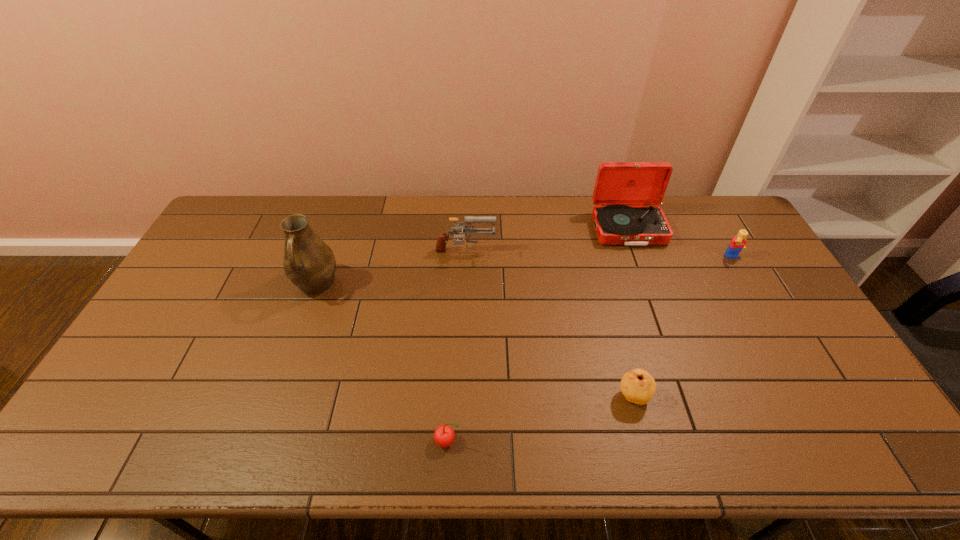
Locate an element on the screen. This screenshot has width=960, height=540. free space located 0.380m on the left of the fifth farthest object is located at coordinates (468, 396).

Locate an element on the screen. The width and height of the screenshot is (960, 540). free space located 0.180m on the right of the cherry is located at coordinates (537, 441).

Identify the location of object that is at the far edge. This screenshot has height=540, width=960. point(626,194).

Find the location of a particular element. object that is at the near edge is located at coordinates (444, 435).

You are a GUI agent. You are given a task and a screenshot of the screen. Output one action in this format:
    pyautogui.click(x=<x>, y=<y>)
    Task: Click on the object that is at the right edge
    The width and height of the screenshot is (960, 540).
    Given the screenshot: What is the action you would take?
    pyautogui.click(x=738, y=243)

Locate an element on the screen. Image resolution: width=960 pixels, height=540 pixels. vacant area at the far edge is located at coordinates (382, 202).

Locate an element on the screen. The height and width of the screenshot is (540, 960). blank space at the left edge is located at coordinates (174, 357).

Identify the location of vacant area that lies between the fifth farthest object and the nearest object. (540, 418).

Locate an element on the screen. free space between the second nearest object and the pitcher is located at coordinates (474, 341).

At what (x,y) coordinates should I click in order to perform the action: click on blank region between the pear and the Lego. Please return your answer as a coordinate pair (x, y). Image resolution: width=960 pixels, height=540 pixels. Looking at the image, I should click on coord(683,327).